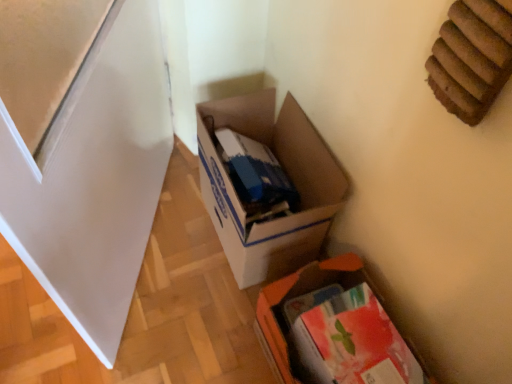
The image size is (512, 384). Identify the location of vacant space in front of white cardboard box at center, which is the 2th box in bottom-to-top order. (203, 319).